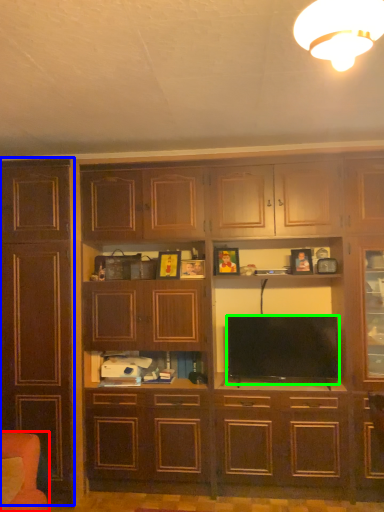
Question: Based on their relative distances, which object is nearer to armchair (highlighted by a red box)? Choose from cabinetry (highlighted by a blue box) and television (highlighted by a green box).

Choices:
 (A) cabinetry
 (B) television

Answer: (A)